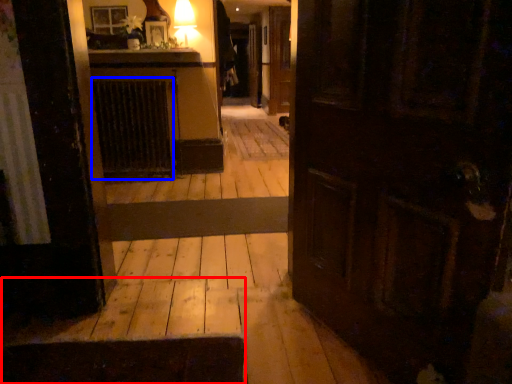
Question: Which object is closer to the camera taking this photo, stairwell (highlighted by a red box) or radiator (highlighted by a blue box)?

Choices:
 (A) stairwell
 (B) radiator

Answer: (A)